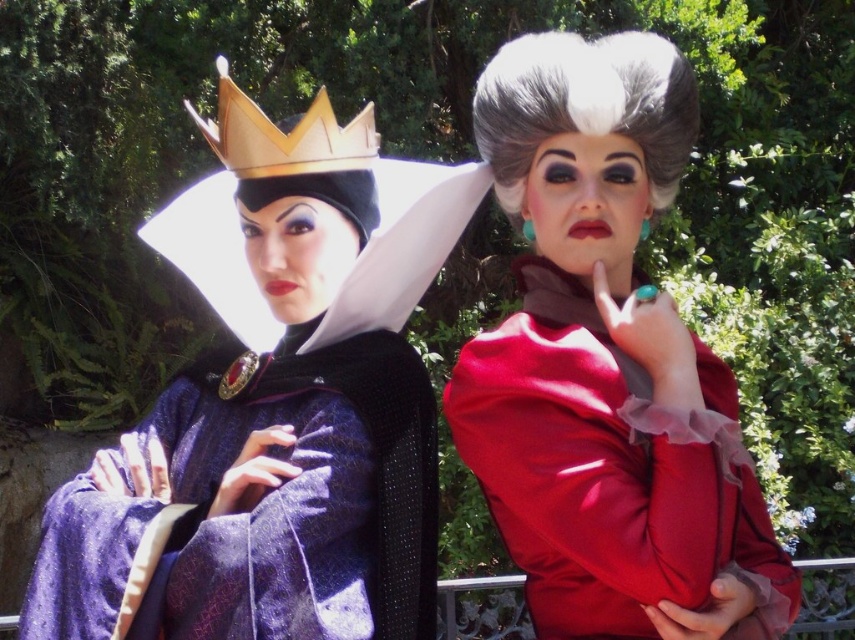
Question: Which of these objects is positioned farthest from the gold metallic crown at upper left?

Choices:
 (A) velvet purple gown at center
 (B) white fluffy wig at upper center

Answer: (B)

Question: Which of the following is the closest to the observer?

Choices:
 (A) (600, 113)
 (B) (282, 241)

Answer: (A)

Question: Does satin red dress at center lie in front of velvet purple gown at center?

Choices:
 (A) yes
 (B) no

Answer: (A)

Question: Can you confirm if satin red dress at center is positioned above white fluffy wig at upper center?

Choices:
 (A) no
 (B) yes

Answer: (A)

Question: Can you confirm if satin red dress at center is positioned to the left of velvet purple gown at center?

Choices:
 (A) no
 (B) yes

Answer: (A)

Question: Which point is closer to the camera?

Choices:
 (A) velvet purple gown at center
 (B) white fluffy wig at upper center
 (C) satin red dress at center

Answer: (C)